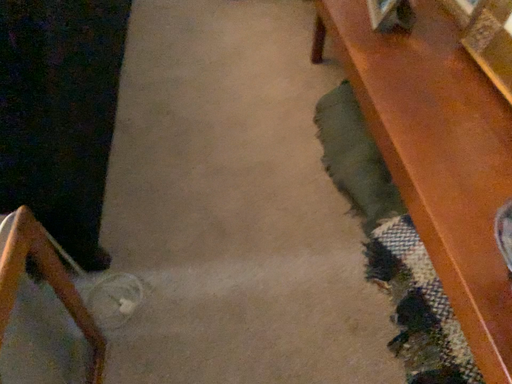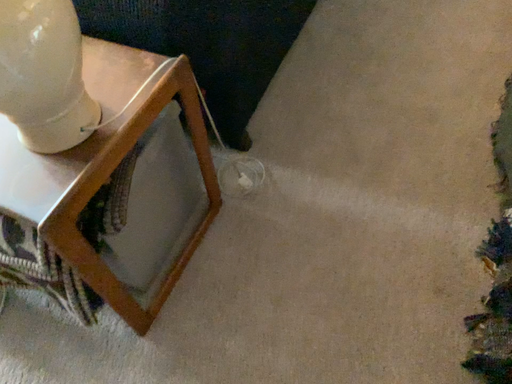
Question: How did the camera likely rotate when shooting the video?

Choices:
 (A) rotated right
 (B) rotated left

Answer: (B)